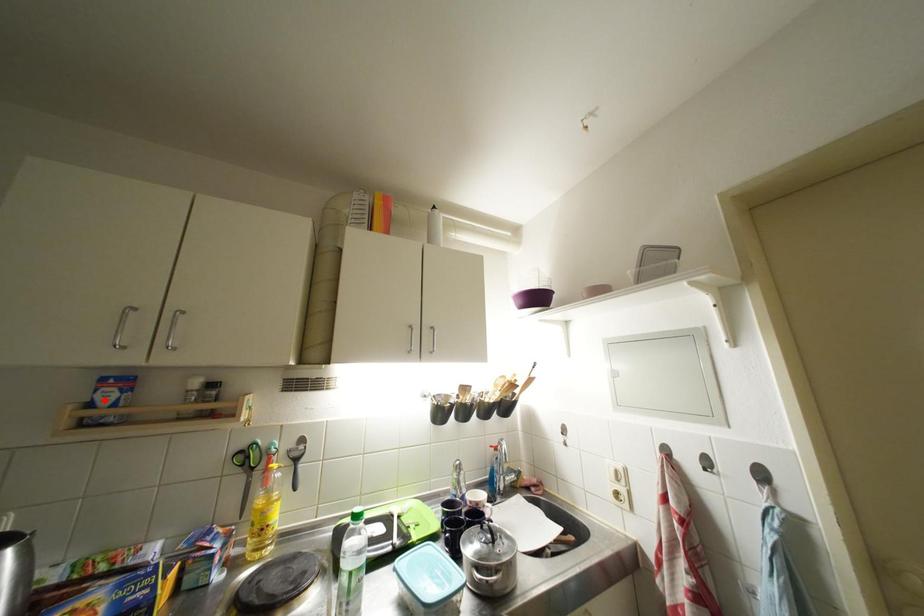
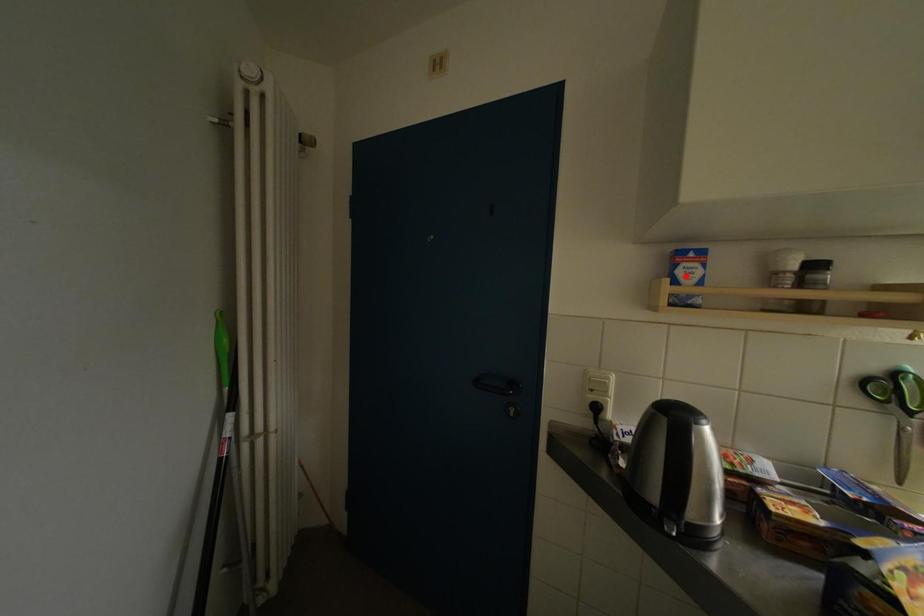
I am providing you with two images of the same scene from different viewpoints. A red point is marked on the first image and another point is marked on the second image. Are the points marked in image1 and image2 representing the same 3D position?

Yes